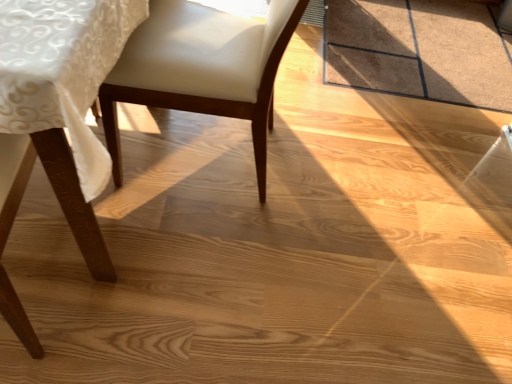
Question: Is point (51, 87) closer or farther from the camera than point (254, 100)?

Choices:
 (A) farther
 (B) closer

Answer: (B)

Question: Looking at the image, does matte wood chair at lower left, the second chair positioned from the right, seem bigger or smaller compared to white leather chair at center, the 1th chair from the right?

Choices:
 (A) small
 (B) big

Answer: (B)

Question: From the image's perspective, is matte wood chair at lower left, the 1th chair from the left, positioned above or below white leather chair at center, positioned as the second chair in left-to-right order?

Choices:
 (A) below
 (B) above

Answer: (A)

Question: Is white leather chair at center, the 1th chair from the right, inside or outside of matte wood chair at lower left, the 1th chair from the left?

Choices:
 (A) inside
 (B) outside

Answer: (B)

Question: From the image's perspective, is white leather chair at center, the 1th chair from the right, above or below matte wood chair at lower left, the 1th chair from the left?

Choices:
 (A) below
 (B) above

Answer: (B)

Question: Relative to matte wood chair at lower left, the 1th chair from the left, is white leather chair at center, positioned as the second chair in left-to-right order, in front or behind?

Choices:
 (A) behind
 (B) front

Answer: (A)

Question: Looking at their shapes, would you say white leather chair at center, positioned as the second chair in left-to-right order, is wider or thinner than matte wood chair at lower left, the second chair positioned from the right?

Choices:
 (A) wide
 (B) thin

Answer: (B)